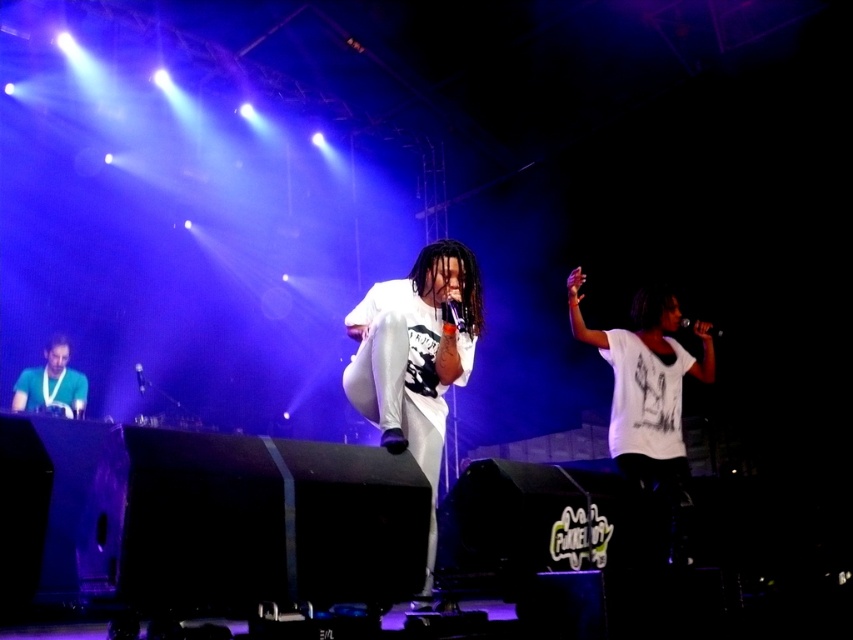
Between green matte shirt at lower left and metallic silver microphone at center, which one is positioned lower?

metallic silver microphone at center

Locate an element on the screen. The height and width of the screenshot is (640, 853). green matte shirt at lower left is located at coordinates (51, 381).

Image resolution: width=853 pixels, height=640 pixels. In order to click on green matte shirt at lower left in this screenshot , I will do `click(51, 381)`.

Identify the location of green matte shirt at lower left. (51, 381).

Which is below, white matte t-shirt at center or black matte microphone at center?

white matte t-shirt at center is lower down.

Between point (373, 355) and point (718, 332), which one is positioned in front?

Positioned in front is point (373, 355).

Locate an element on the screen. The width and height of the screenshot is (853, 640). white matte t-shirt at center is located at coordinates (415, 358).

What do you see at coordinates (51, 381) in the screenshot?
I see `green matte shirt at lower left` at bounding box center [51, 381].

Where is `green matte shirt at lower left`? Image resolution: width=853 pixels, height=640 pixels. green matte shirt at lower left is located at coordinates (51, 381).

This screenshot has height=640, width=853. I want to click on green matte shirt at lower left, so click(51, 381).